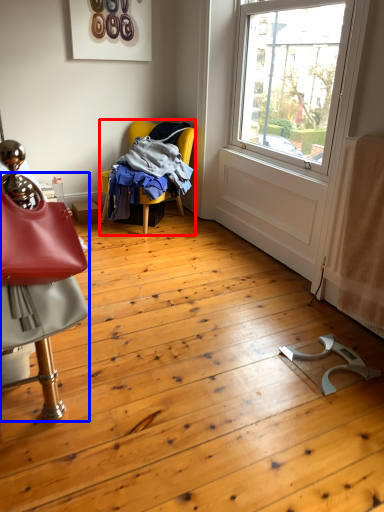
Question: Which of the following is the closest to the observer, chair (highlighted by a red box) or chair (highlighted by a blue box)?

Choices:
 (A) chair
 (B) chair

Answer: (B)